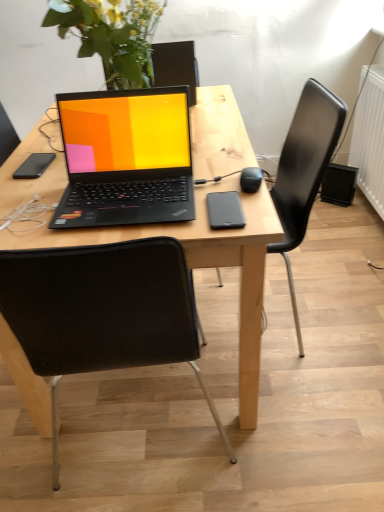
Find the location of `vacant area that lies to the right of black matte phone at center, which appears as the 2th mobile phone when viewed from the back`. vacant area that lies to the right of black matte phone at center, which appears as the 2th mobile phone when viewed from the back is located at coordinates (260, 207).